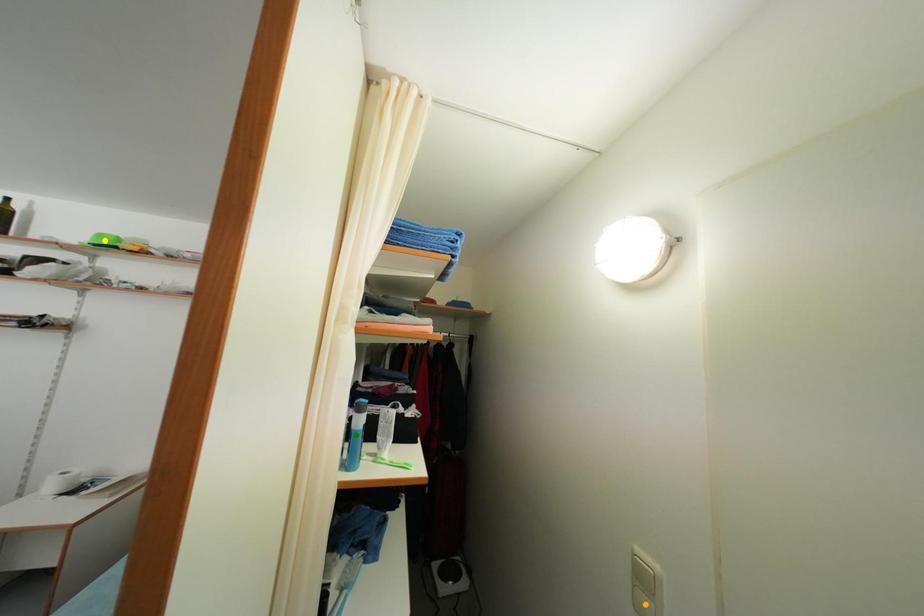
Order these from nearest to farthest:
yellow point
orange point
green point

1. orange point
2. green point
3. yellow point